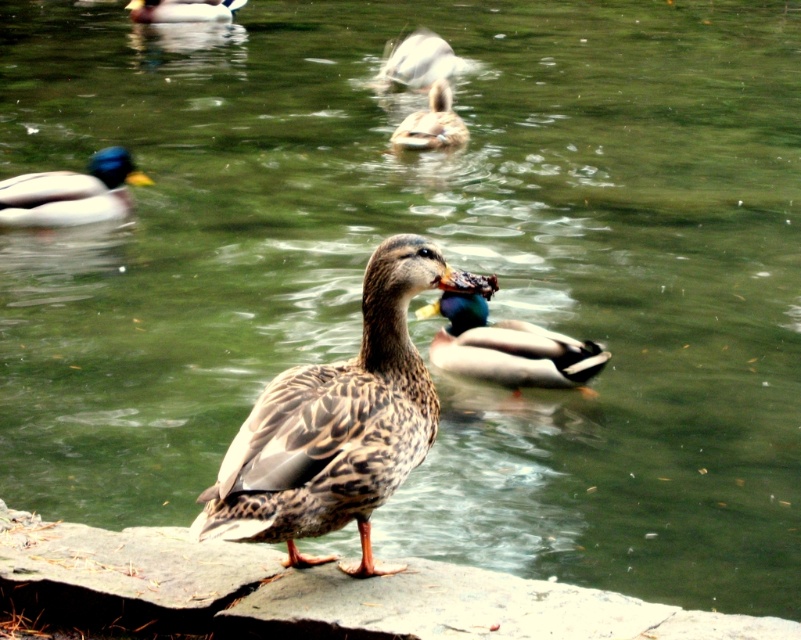
Is point (66, 212) in front of point (437, 58)?

Yes, point (66, 212) is closer to viewer.

Is point (13, 188) positioned behind point (417, 72)?

No, (13, 188) is closer to viewer.

Find the location of a particular element. shiny green drake at left is located at coordinates (70, 193).

Between brown speckled feathers at upper center and brown speckled feathers at upper left, which one has more height?

brown speckled feathers at upper center is taller.

This screenshot has height=640, width=801. What are the coordinates of `brown speckled feathers at upper center` in the screenshot? It's located at (431, 122).

The height and width of the screenshot is (640, 801). I want to click on brown speckled feathers at upper center, so click(431, 122).

Between shiny green drake at center and brown speckled feathers at upper center, which one has less height?

shiny green drake at center is shorter.

Can you confirm if shiny green drake at center is smaller than brown speckled feathers at upper center?

No.

Is point (477, 308) more distant than point (421, 124)?

No.

Find the location of a particular element. shiny green drake at center is located at coordinates (506, 348).